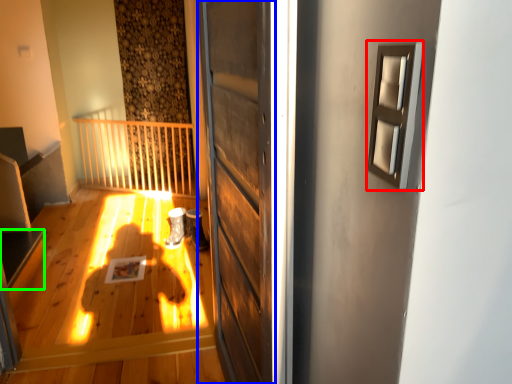
Question: Which object is the farthest from window (highlighted by a red box)? Choose among these: door (highlighted by a blue box) or stairwell (highlighted by a green box).

Choices:
 (A) door
 (B) stairwell

Answer: (B)